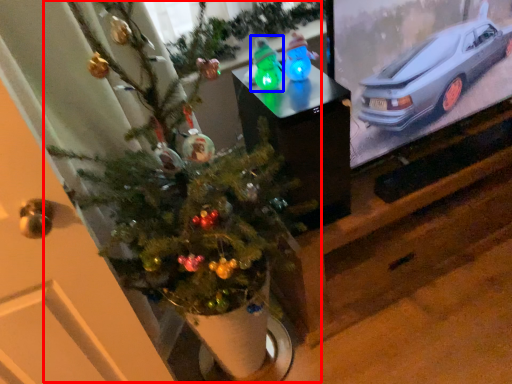
Question: Which object is closer to the camera taking this photo, christmas tree (highlighted by a red box) or toy (highlighted by a blue box)?

Choices:
 (A) christmas tree
 (B) toy

Answer: (A)